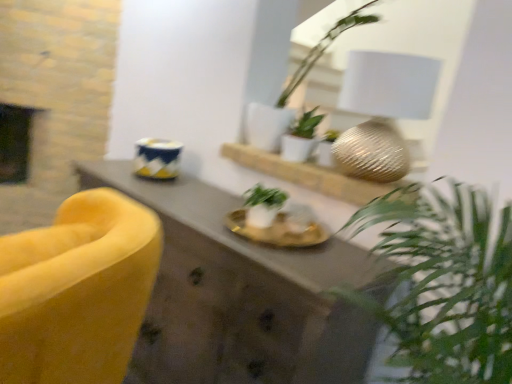
Question: Is white matte plant at center, placed as the 2th houseplant when sorted from top to bottom, at the back of velvet yellow armchair at left?

Choices:
 (A) no
 (B) yes

Answer: (A)

Question: Can you confirm if velvet yellow armchair at left is smaller than white matte plant at center, the 2th houseplant from the bottom?

Choices:
 (A) yes
 (B) no

Answer: (B)

Question: From the image's perspective, does velvet yellow armchair at left appear higher than white matte plant at center, placed as the 2th houseplant when sorted from top to bottom?

Choices:
 (A) yes
 (B) no

Answer: (B)

Question: Is velvet yellow armchair at left bigger than white matte plant at center, placed as the 2th houseplant when sorted from top to bottom?

Choices:
 (A) yes
 (B) no

Answer: (A)

Question: Considering the relative sizes of velvet yellow armchair at left and white matte plant at center, placed as the 2th houseplant when sorted from top to bottom, in the image provided, is velvet yellow armchair at left thinner than white matte plant at center, placed as the 2th houseplant when sorted from top to bottom,?

Choices:
 (A) no
 (B) yes

Answer: (A)

Question: Is velvet yellow armchair at left shorter than white matte plant at center, the 2th houseplant from the bottom?

Choices:
 (A) yes
 (B) no

Answer: (B)

Question: Can you confirm if white ceramic plant at upper center, which appears as the third houseplant when ordered from the bottom, is positioned to the left of metallic gold sphere at center?

Choices:
 (A) no
 (B) yes

Answer: (B)

Question: Does white ceramic plant at upper center, which is the 1th houseplant from top to bottom, have a greater height compared to metallic gold sphere at center?

Choices:
 (A) yes
 (B) no

Answer: (A)

Question: Considering the relative sizes of white ceramic plant at upper center, which appears as the third houseplant when ordered from the bottom, and metallic gold sphere at center in the image provided, is white ceramic plant at upper center, which appears as the third houseplant when ordered from the bottom, shorter than metallic gold sphere at center?

Choices:
 (A) no
 (B) yes

Answer: (A)

Question: From the image's perspective, does white ceramic plant at upper center, which appears as the third houseplant when ordered from the bottom, appear lower than metallic gold sphere at center?

Choices:
 (A) yes
 (B) no

Answer: (B)

Question: Would you consider white ceramic plant at upper center, which is the 1th houseplant from top to bottom, to be distant from metallic gold sphere at center?

Choices:
 (A) no
 (B) yes

Answer: (A)

Question: Is white ceramic plant at upper center, which appears as the third houseplant when ordered from the bottom, to the right of metallic gold sphere at center from the viewer's perspective?

Choices:
 (A) yes
 (B) no

Answer: (B)

Question: Can you confirm if white ceramic plant at upper center, which appears as the third houseplant when ordered from the bottom, is smaller than velvet yellow armchair at left?

Choices:
 (A) no
 (B) yes

Answer: (B)